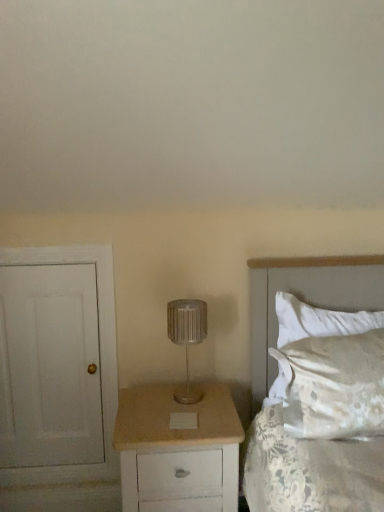
Question: Is beige wood chest of drawers at center shorter than white satin pillow at right?

Choices:
 (A) yes
 (B) no

Answer: (B)

Question: Is beige wood chest of drawers at center positioned before white satin pillow at right?

Choices:
 (A) no
 (B) yes

Answer: (B)

Question: Is beige wood chest of drawers at center oriented away from white satin pillow at right?

Choices:
 (A) yes
 (B) no

Answer: (B)

Question: From a real-world perspective, is beige wood chest of drawers at center positioned under white satin pillow at right based on gravity?

Choices:
 (A) no
 (B) yes

Answer: (B)

Question: Is beige wood chest of drawers at center in contact with white satin pillow at right?

Choices:
 (A) no
 (B) yes

Answer: (A)

Question: Considering the positions of point (332, 271) and point (6, 267), is point (332, 271) closer or farther from the camera than point (6, 267)?

Choices:
 (A) closer
 (B) farther

Answer: (B)

Question: Considering the positions of white satin bed at right and white painted wood door at left in the image, is white satin bed at right taller or shorter than white painted wood door at left?

Choices:
 (A) short
 (B) tall

Answer: (A)

Question: From a real-world perspective, is white satin bed at right physically located above or below white painted wood door at left?

Choices:
 (A) below
 (B) above

Answer: (B)

Question: From the image's perspective, relative to white painted wood door at left, is white satin bed at right above or below?

Choices:
 (A) above
 (B) below

Answer: (A)

Question: Relative to beige wood chest of drawers at center, is white painted wood door at left in front or behind?

Choices:
 (A) front
 (B) behind

Answer: (B)

Question: From a real-world perspective, is white painted wood door at left positioned above or below beige wood chest of drawers at center?

Choices:
 (A) above
 (B) below

Answer: (A)

Question: Is white painted wood door at left taller or shorter than beige wood chest of drawers at center?

Choices:
 (A) short
 (B) tall

Answer: (B)

Question: Is point (94, 387) positioned closer to the camera than point (132, 444)?

Choices:
 (A) closer
 (B) farther

Answer: (B)

Question: Considering their positions, is white painted wood door at left located in front of or behind white satin pillow at right?

Choices:
 (A) front
 (B) behind

Answer: (B)

Question: Looking at their shapes, would you say white painted wood door at left is wider or thinner than white satin pillow at right?

Choices:
 (A) wide
 (B) thin

Answer: (B)